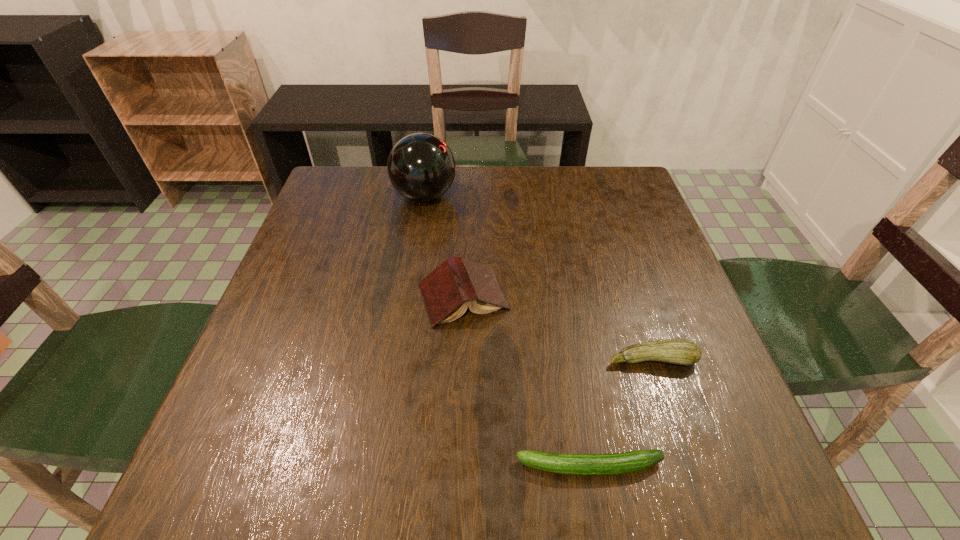
Locate an element on the screen. The height and width of the screenshot is (540, 960). unoccupied area between the bowling ball and the shortest object is located at coordinates (507, 331).

At what (x,y) coordinates should I click in order to perform the action: click on free spot between the farther zucchini and the farthest object. Please return your answer as a coordinate pair (x, y). Looking at the image, I should click on (539, 278).

The height and width of the screenshot is (540, 960). I want to click on free spot between the nearer zucchini and the bowling ball, so click(507, 331).

Identify the location of free space between the nearest object and the third shortest object. The width and height of the screenshot is (960, 540). (526, 381).

Select which object appears as the third closest to the third tallest object. Please provide its 2D coordinates. Your answer should be formatted as a tuple, i.e. [(x, y)], where the tuple contains the x and y coordinates of a point satisfying the conditions above.

[(421, 167)]

Image resolution: width=960 pixels, height=540 pixels. Identify the location of object that stands as the third closest to the farther zucchini. (421, 167).

This screenshot has height=540, width=960. Find the location of `vacant space that satisfies the following two spatial constraints: 1. at the stem end of the farther zucchini; 2. on the front-facing side of the shorter zucchini`. vacant space that satisfies the following two spatial constraints: 1. at the stem end of the farther zucchini; 2. on the front-facing side of the shorter zucchini is located at coordinates (686, 466).

Locate an element on the screen. vacant position in the image that satisfies the following two spatial constraints: 1. at the stem end of the farther zucchini; 2. on the front-facing side of the nearer zucchini is located at coordinates (686, 466).

Where is `vacant area that satisfies the following two spatial constraints: 1. at the stem end of the taller zucchini; 2. on the front-facing side of the nearer zucchini`? This screenshot has height=540, width=960. vacant area that satisfies the following two spatial constraints: 1. at the stem end of the taller zucchini; 2. on the front-facing side of the nearer zucchini is located at coordinates (686, 466).

The height and width of the screenshot is (540, 960). I want to click on vacant point that satisfies the following two spatial constraints: 1. at the stem end of the farther zucchini; 2. on the front-facing side of the nearer zucchini, so click(686, 466).